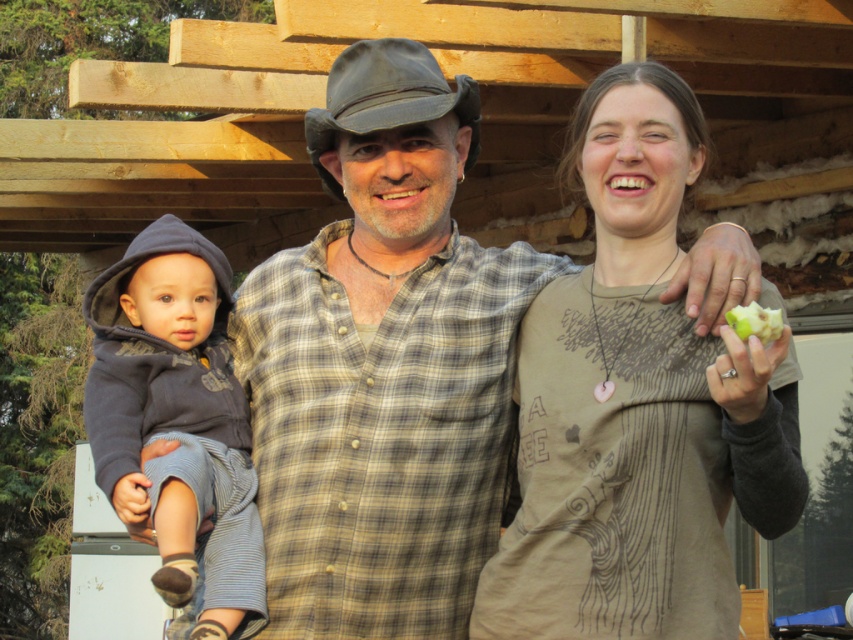
You are a photographer setting up for a family portrait. You notice the matte brown sweater at center and the dark gray fleece hoodie at left. Which clothing item is positioned higher in the image?

The matte brown sweater at center is positioned higher in the image as it is above the dark gray fleece hoodie at left.

You are a photographer trying to capture the baby in the matte brown sweater at center and the green matte apple at upper right in your shot. Which object is positioned higher in the image?

The green matte apple at upper right is positioned higher than the matte brown sweater at center, as the sweater is located below the apple.